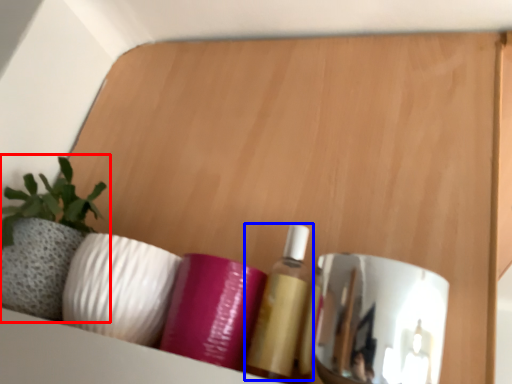
Question: Which object appears farthest to the camera in this image, houseplant (highlighted by a red box) or toiletry (highlighted by a blue box)?

Choices:
 (A) houseplant
 (B) toiletry

Answer: (A)